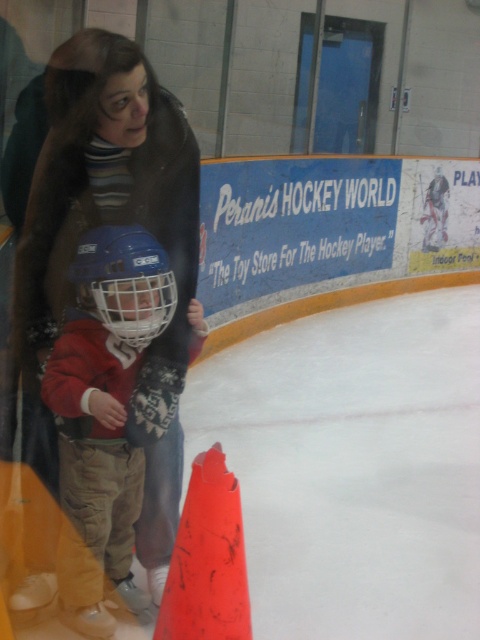
Between matte red helmet at center and orange matte traffic cone at lower center, which one is positioned higher?

matte red helmet at center is above.

Is matte red helmet at center smaller than orange matte traffic cone at lower center?

Incorrect, matte red helmet at center is not smaller in size than orange matte traffic cone at lower center.

Where is `matte red helmet at center`? matte red helmet at center is located at coordinates click(104, 410).

Which is in front, point (203, 637) or point (164, 275)?

Point (203, 637)

You are a GUI agent. You are given a task and a screenshot of the screen. Output one action in this format:
    pyautogui.click(x=<x>, y=<y>)
    Task: Click on the orange matte traffic cone at lower center
    This screenshot has height=640, width=480.
    Given the screenshot: What is the action you would take?
    pyautogui.click(x=207, y=560)

Can you confirm if matte red helmet at center is thinner than matte blue helmet at left?

In fact, matte red helmet at center might be wider than matte blue helmet at left.

How far apart are matte red helmet at center and matte blue helmet at left?

4.28 inches

Identify the location of matte red helmet at center. (104, 410).